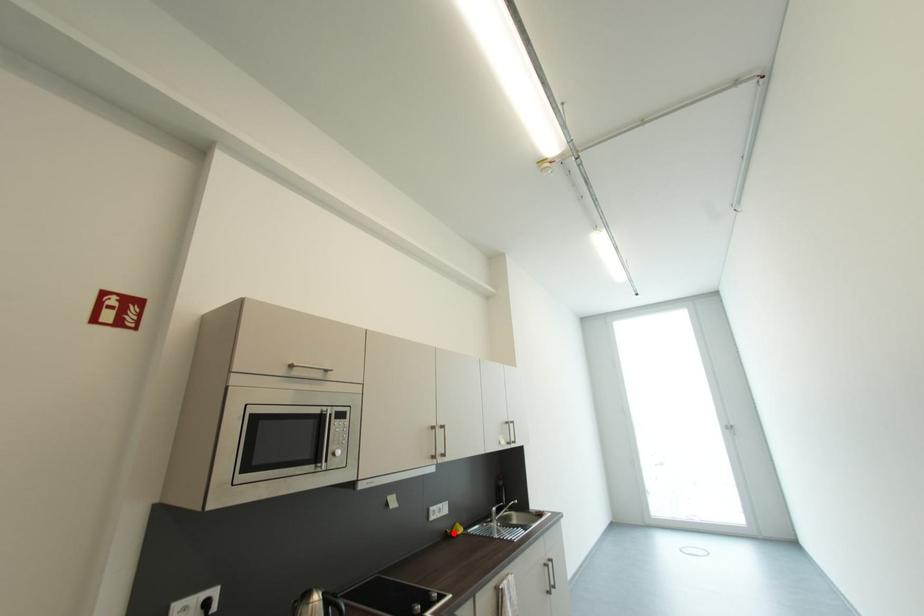
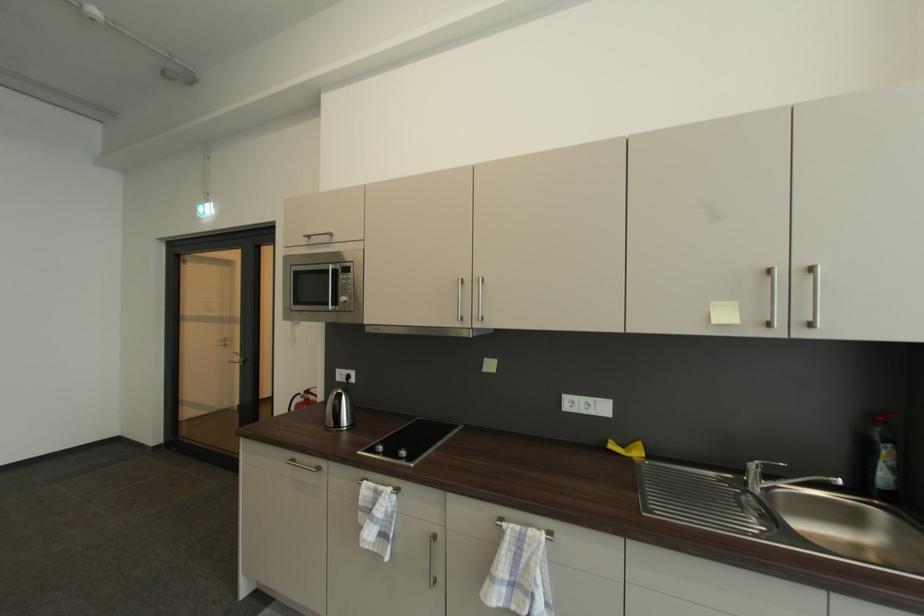
Locate, in the second image, the point that corresponds to the highlighted location in the first image.

(613, 443)